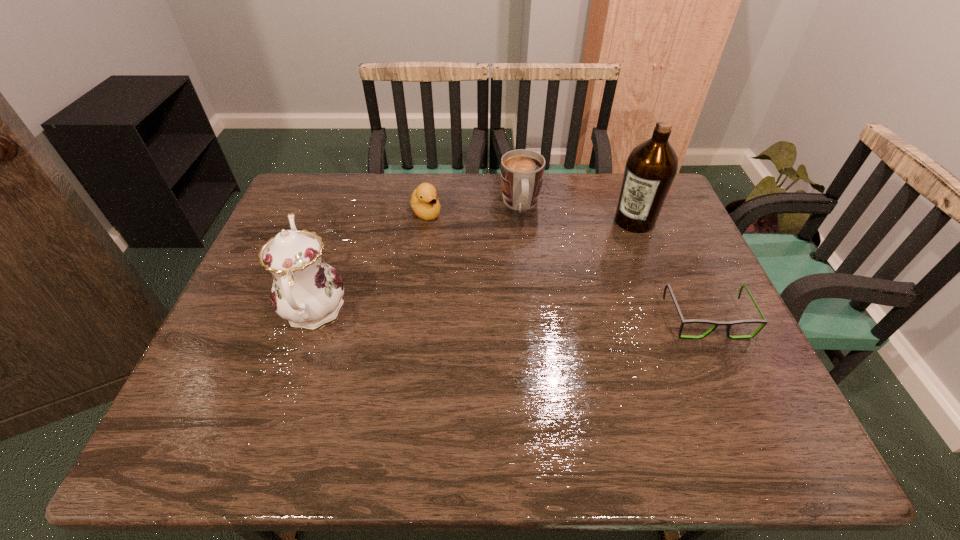
Where is `free space at the far left corner of the desktop`? The height and width of the screenshot is (540, 960). free space at the far left corner of the desktop is located at coordinates (300, 211).

Locate an element on the screen. Image resolution: width=960 pixels, height=540 pixels. vacant space at the near left corner of the desktop is located at coordinates [206, 390].

At what (x,y) coordinates should I click in order to perform the action: click on unoccupied area between the olive oil and the mug. Please return your answer as a coordinate pair (x, y). This screenshot has height=540, width=960. Looking at the image, I should click on (578, 213).

Where is `vacant area that lies between the leftmost object and the fourth tallest object`? The image size is (960, 540). vacant area that lies between the leftmost object and the fourth tallest object is located at coordinates click(370, 262).

You are a GUI agent. You are given a task and a screenshot of the screen. Output one action in this format:
    pyautogui.click(x=<x>, y=<y>)
    Task: Click on the vacant area between the leftmost object and the shortest object
    This screenshot has width=960, height=540.
    Given the screenshot: What is the action you would take?
    pyautogui.click(x=510, y=315)

The image size is (960, 540). I want to click on empty space that is in between the olive oil and the third tallest object, so click(x=578, y=213).

Locate an element on the screen. free point between the olive oil and the duckling is located at coordinates (530, 217).

The image size is (960, 540). Identify the location of vacant area that lies between the mug and the shortest object. (613, 262).

Where is `empty space that is in between the olive oil and the chinaware`? empty space that is in between the olive oil and the chinaware is located at coordinates (474, 266).

This screenshot has width=960, height=540. What are the coordinates of `vacant area that lies between the third object from left to right and the chinaware` in the screenshot? It's located at (418, 258).